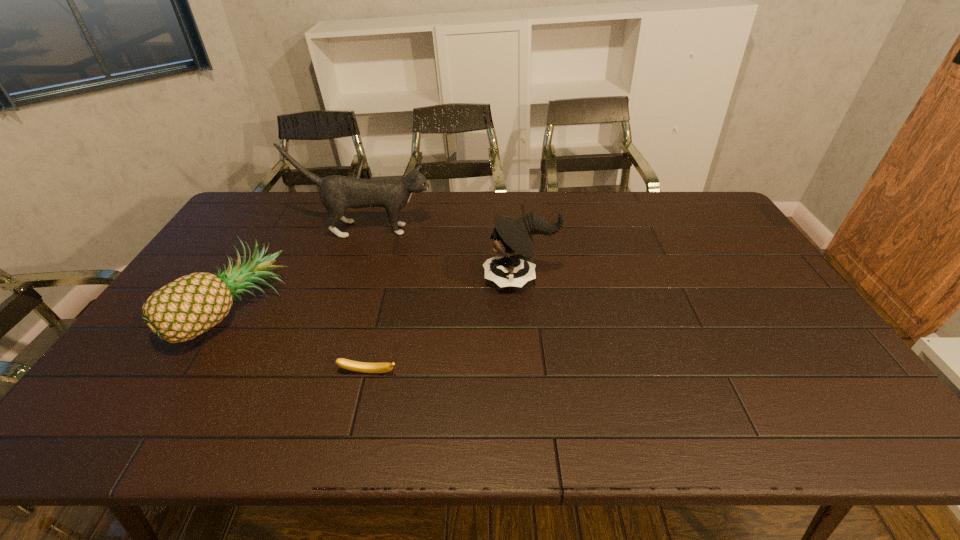
This screenshot has width=960, height=540. In order to click on the tallest object in this screenshot , I will do `click(337, 193)`.

Locate an element on the screen. the farthest object is located at coordinates (337, 193).

Find the location of a particular element. The height and width of the screenshot is (540, 960). doll is located at coordinates (513, 243).

Image resolution: width=960 pixels, height=540 pixels. Identify the location of the rightmost object. (513, 243).

Locate an element on the screen. This screenshot has width=960, height=540. the second shortest object is located at coordinates (189, 306).

Locate an element on the screen. Image resolution: width=960 pixels, height=540 pixels. the nearest object is located at coordinates (364, 367).

At what (x,y) coordinates should I click in order to perform the action: click on the shortest object. Please return your answer as a coordinate pair (x, y). The image size is (960, 540). Looking at the image, I should click on (364, 367).

Find the location of `free spot located 0.270m at the face of the cat`. free spot located 0.270m at the face of the cat is located at coordinates (511, 230).

Locate an element on the screen. The width and height of the screenshot is (960, 540). vacant area located at the face of the rightmost object is located at coordinates (433, 279).

This screenshot has height=540, width=960. In order to click on free spot located at the face of the rightmost object in this screenshot , I will do `click(437, 279)`.